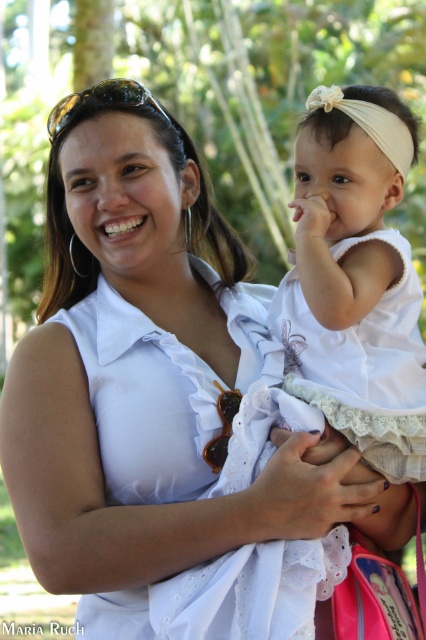
Question: Does white lace dress at center appear on the right side of beige fabric headband at upper center?

Choices:
 (A) yes
 (B) no

Answer: (B)

Question: Which point is closer to the camera?

Choices:
 (A) white lace dress at center
 (B) beige fabric headband at upper center

Answer: (A)

Question: Which point is closer to the camera?

Choices:
 (A) beige fabric headband at upper center
 (B) white lace dress at center

Answer: (B)

Question: Does white lace dress at center have a lesser width compared to beige fabric headband at upper center?

Choices:
 (A) no
 (B) yes

Answer: (A)

Question: Which object is farther from the camera taking this photo?

Choices:
 (A) beige fabric headband at upper center
 (B) white lace dress at center

Answer: (A)

Question: Does white lace dress at center come behind beige fabric headband at upper center?

Choices:
 (A) no
 (B) yes

Answer: (A)